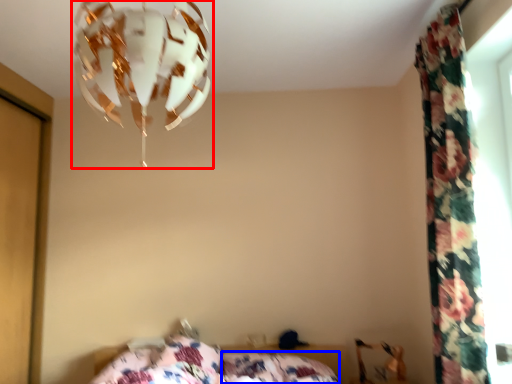
Question: Which of the following is the farthest to the observer, lamp (highlighted by a red box) or pillow (highlighted by a blue box)?

Choices:
 (A) lamp
 (B) pillow

Answer: (B)